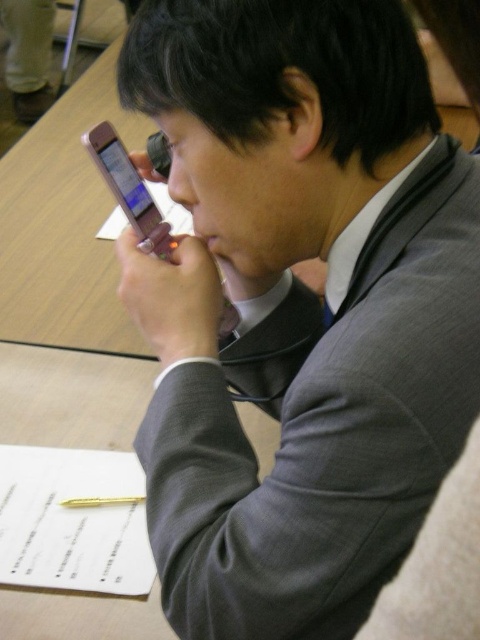
Measure the distance between pink glossy smartphone at center and camera.

pink glossy smartphone at center is 23.97 inches from camera.

Is pink glossy smartphone at center positioned before gold metallic pen at lower center?

That is True.

Between point (151, 220) and point (134, 496), which one is positioned in front?

Point (151, 220) is in front.

Locate an element on the screen. The height and width of the screenshot is (640, 480). pink glossy smartphone at center is located at coordinates (129, 189).